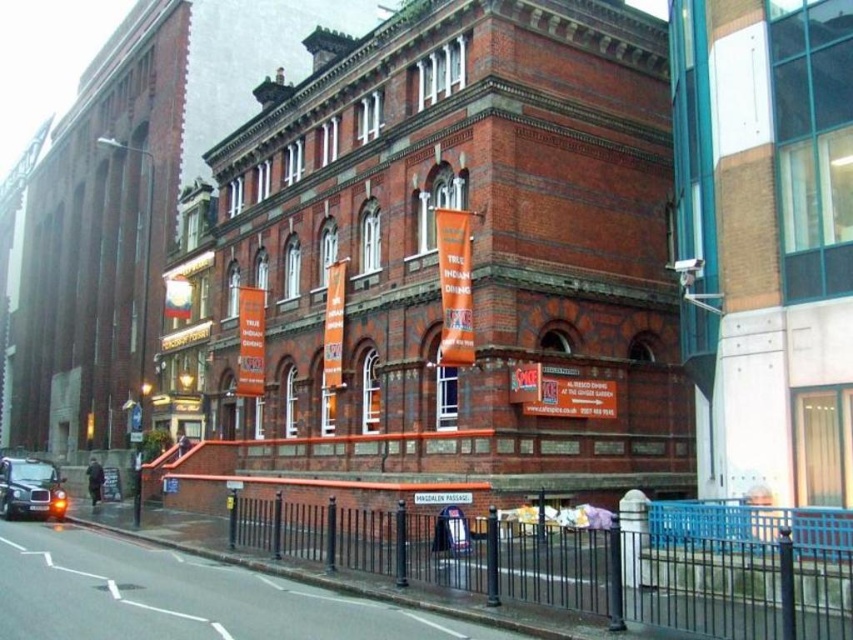
You are a pedestrian standing at the entrance of the red brick building. You want to cross the street to the park on the other side. Is the black metal fence at lower center blocking your path to the black matte taxi cab at lower left?

The black metal fence at lower center is in front of the black matte taxi cab at lower left, so it would block your path to the taxi cab.

You are a pedestrian standing on the sidewalk in front of the red brick building. You see the black metal fence at lower center and the black matte taxi cab at lower left. Which object is closer to your feet?

The black matte taxi cab at lower left is closer to your feet because the black metal fence at lower center is located above it.